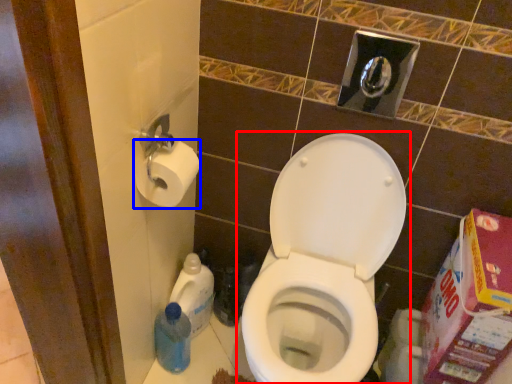
Question: Which object is further to the camera taking this photo, toilet (highlighted by a red box) or toilet paper (highlighted by a blue box)?

Choices:
 (A) toilet
 (B) toilet paper

Answer: (B)